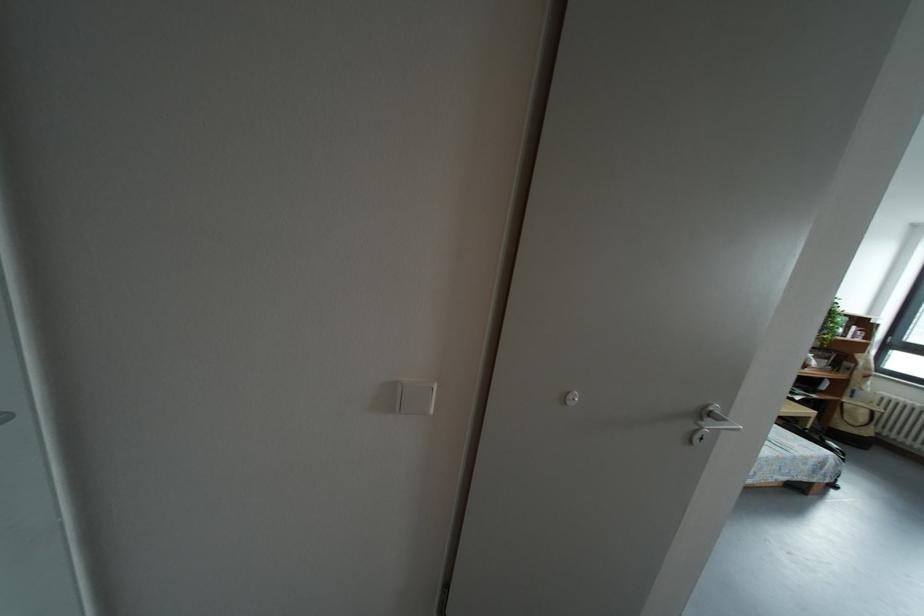
The height and width of the screenshot is (616, 924). Find the location of `silver door handle`. silver door handle is located at coordinates (713, 422).